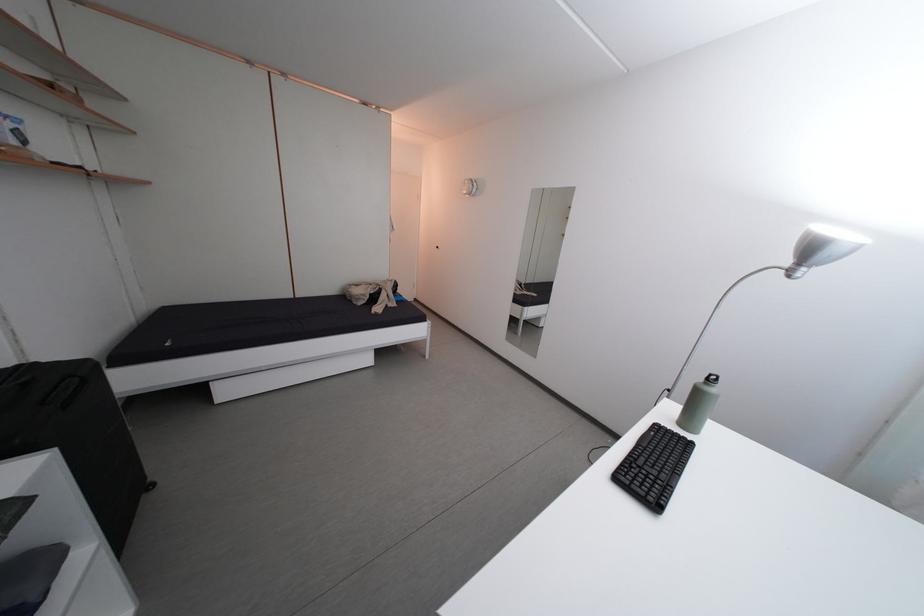
Locate an element on the screen. The height and width of the screenshot is (616, 924). black suitcase handle is located at coordinates (13, 385).